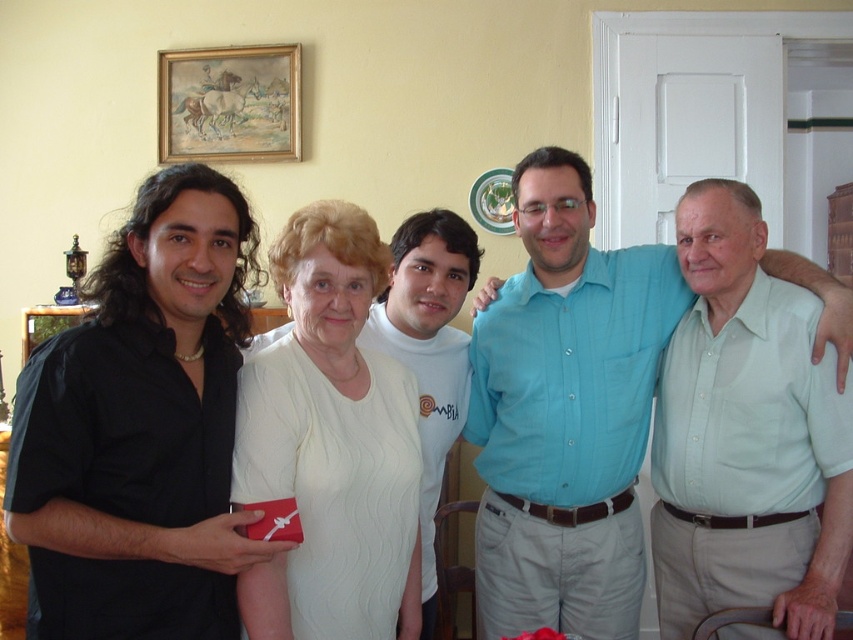
Question: Can you confirm if light green shirt at center is thinner than white knit sweater at center?

Choices:
 (A) no
 (B) yes

Answer: (A)

Question: Which of the following is the closest to the observer?

Choices:
 (A) (257, 387)
 (B) (165, 83)
 (C) (546, 330)
 (D) (27, 317)

Answer: (A)

Question: Does black matte shirt at left appear on the left side of white knit sweater at center?

Choices:
 (A) no
 (B) yes

Answer: (B)

Question: Estimate the real-world distances between objects in this image. Which object is closer to the light green shirt at center?

Choices:
 (A) white knit sweater at center
 (B) black matte shirt at left
 (C) wooden picture frame at left

Answer: (A)

Question: In this image, where is light blue shirt at center located relative to gold wooden picture frame at upper center?

Choices:
 (A) right
 (B) left

Answer: (A)

Question: Which of the following is the farthest from the observer?

Choices:
 (A) light green shirt at center
 (B) black matte shirt at left
 (C) light blue shirt at center

Answer: (C)